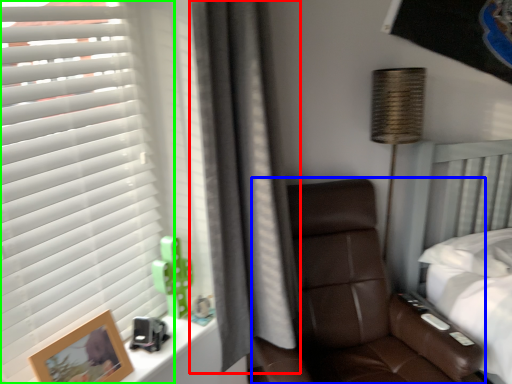
Question: Which is farther away from curtain (highlighted by a red box)? chair (highlighted by a blue box) or window blind (highlighted by a green box)?

Choices:
 (A) chair
 (B) window blind

Answer: (A)